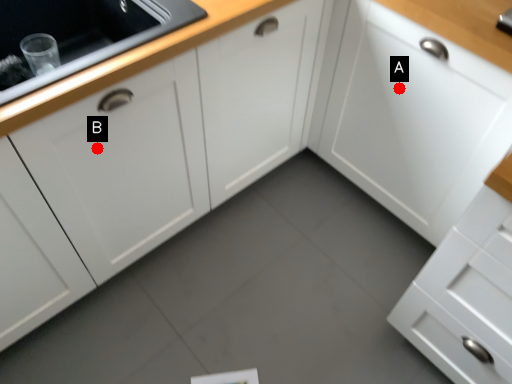
Question: Two points are circled on the image, labeled by A and B beside each circle. Which point appears farthest from the camera in this image?

Choices:
 (A) A is further
 (B) B is further

Answer: (A)